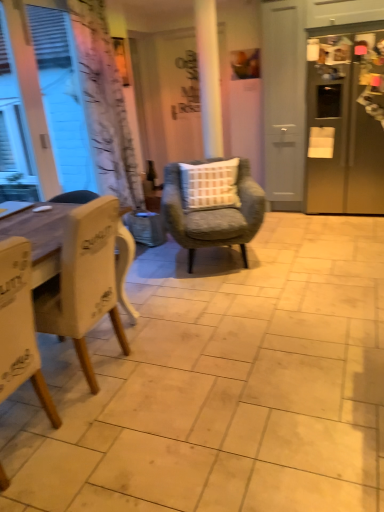
Question: Can you confirm if white matte window at left is smaller than white wood chair at left, which is counted as the third chair, starting from the back?

Choices:
 (A) yes
 (B) no

Answer: (A)

Question: From the image's perspective, is white matte window at left above white wood chair at left, which is counted as the third chair, starting from the back?

Choices:
 (A) yes
 (B) no

Answer: (A)

Question: Considering the relative positions of white matte window at left and white wood chair at left, which is counted as the third chair, starting from the back, in the image provided, is white matte window at left to the right of white wood chair at left, which is counted as the third chair, starting from the back, from the viewer's perspective?

Choices:
 (A) no
 (B) yes

Answer: (A)

Question: Can you confirm if white matte window at left is shorter than white wood chair at left, the first chair from the front?

Choices:
 (A) no
 (B) yes

Answer: (A)

Question: From a real-world perspective, does white matte window at left sit lower than white wood chair at left, which is counted as the third chair, starting from the back?

Choices:
 (A) no
 (B) yes

Answer: (A)

Question: Based on their positions, is white wood chair at left, which is counted as the third chair, starting from the back, located to the left or right of white matte window at left?

Choices:
 (A) left
 (B) right

Answer: (B)

Question: From the image's perspective, relative to white matte window at left, is white wood chair at left, the first chair from the front, above or below?

Choices:
 (A) above
 (B) below

Answer: (B)

Question: Looking at their shapes, would you say white wood chair at left, which is counted as the third chair, starting from the back, is wider or thinner than white matte window at left?

Choices:
 (A) wide
 (B) thin

Answer: (A)

Question: From a real-world perspective, is white wood chair at left, which is counted as the third chair, starting from the back, above or below white matte window at left?

Choices:
 (A) below
 (B) above

Answer: (A)

Question: In the image, is white wood chair at left, the first chair from the front, positioned in front of or behind white wood chair at left, which appears as the second chair when viewed from the back?

Choices:
 (A) behind
 (B) front

Answer: (B)

Question: In terms of size, does white wood chair at left, which is counted as the third chair, starting from the back, appear bigger or smaller than white wood chair at left, which appears as the second chair when viewed from the back?

Choices:
 (A) big
 (B) small

Answer: (B)

Question: Is white wood chair at left, the first chair from the front, to the left or to the right of white wood chair at left, the second chair when ordered from front to back, in the image?

Choices:
 (A) right
 (B) left

Answer: (B)

Question: Is white wood chair at left, the first chair from the front, situated inside white wood chair at left, the second chair when ordered from front to back, or outside?

Choices:
 (A) outside
 (B) inside

Answer: (A)

Question: Considering the relative positions of white wood chair at left, which is counted as the third chair, starting from the back, and satin silver refrigerator at right in the image provided, is white wood chair at left, which is counted as the third chair, starting from the back, to the left or to the right of satin silver refrigerator at right?

Choices:
 (A) left
 (B) right

Answer: (A)

Question: From a real-world perspective, relative to satin silver refrigerator at right, is white wood chair at left, the first chair from the front, vertically above or below?

Choices:
 (A) below
 (B) above

Answer: (A)